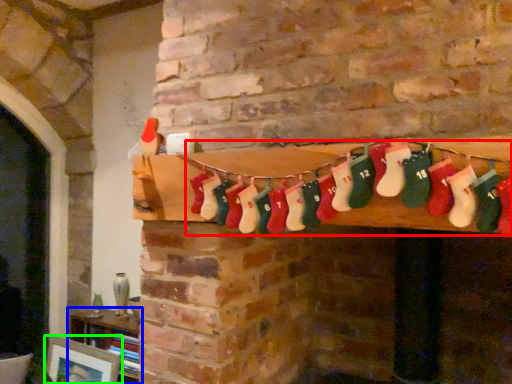
Question: Considering the real-world distances, which object is closest to sock (highlighted by a red box)? furniture (highlighted by a blue box) or picture frame (highlighted by a green box).

Choices:
 (A) furniture
 (B) picture frame

Answer: (A)